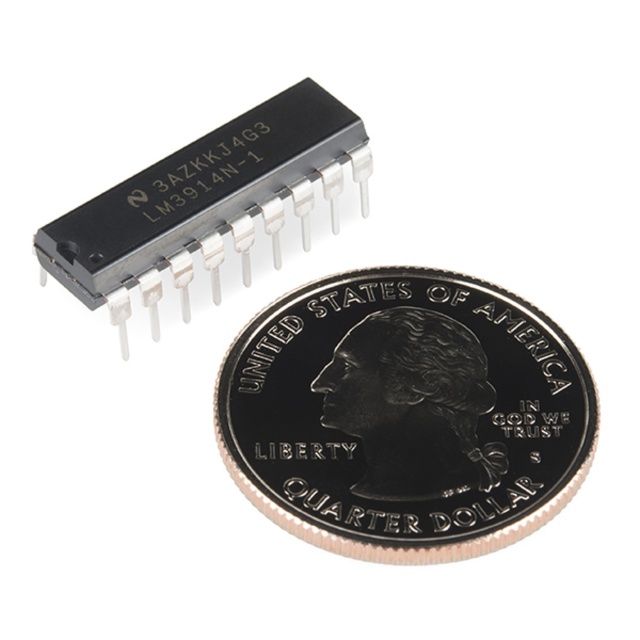
Is silver/glossy/quarter dollar at center bigger than black plastic ic at upper left?

Indeed, silver/glossy/quarter dollar at center has a larger size compared to black plastic ic at upper left.

Which is more to the left, silver/glossy/quarter dollar at center or black plastic ic at upper left?

black plastic ic at upper left

At what (x,y) coordinates should I click in order to perform the action: click on silver/glossy/quarter dollar at center. Please return your answer as a coordinate pair (x, y). Looking at the image, I should click on (404, 413).

Find the location of `silver/glossy/quarter dollar at center`. silver/glossy/quarter dollar at center is located at coordinates (404, 413).